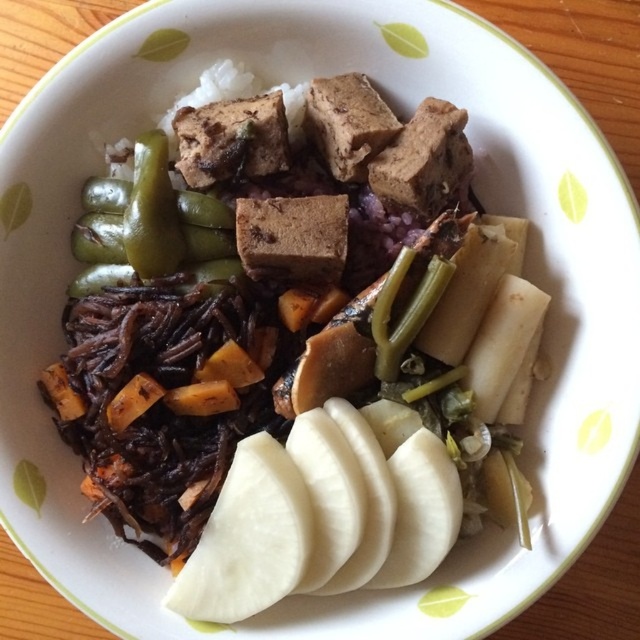
Question: Which of the following is the farthest from the observer?

Choices:
 (A) white matte sliced potatoes at lower center
 (B) green glossy pepper at upper left

Answer: (B)

Question: Which point is farther to the camera?

Choices:
 (A) (164, 156)
 (B) (442, 362)

Answer: (A)

Question: Considering the relative positions of white matte sliced potatoes at lower center and green glossy pepper at upper left in the image provided, where is white matte sliced potatoes at lower center located with respect to green glossy pepper at upper left?

Choices:
 (A) above
 (B) below

Answer: (B)

Question: Which of the following is the closest to the observer?

Choices:
 (A) white matte sliced potatoes at lower center
 (B) green glossy pepper at upper left

Answer: (A)

Question: Can you confirm if white matte sliced potatoes at lower center is positioned above green glossy pepper at upper left?

Choices:
 (A) yes
 (B) no

Answer: (B)

Question: Is white matte sliced potatoes at lower center smaller than green glossy pepper at upper left?

Choices:
 (A) no
 (B) yes

Answer: (A)